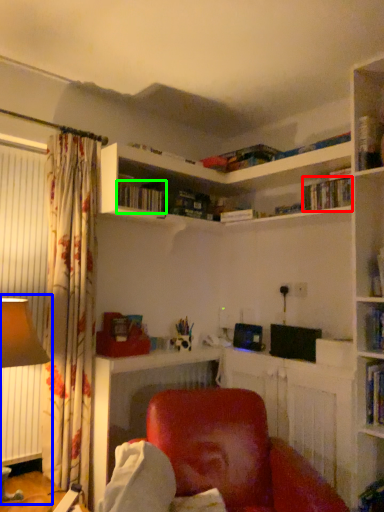
Question: Estimate the real-world distances between objects in this image. Which object is closer to book (highlighted by a red box), table lamp (highlighted by a blue box) or book (highlighted by a green box)?

Choices:
 (A) table lamp
 (B) book

Answer: (B)